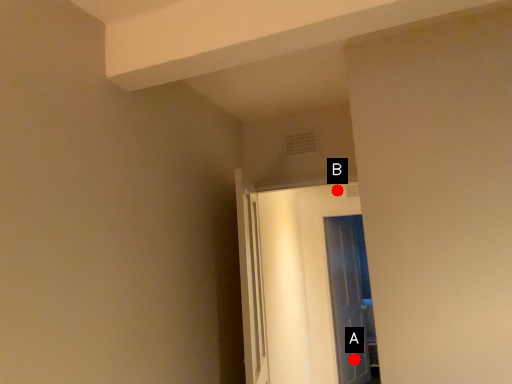
Question: Two points are circled on the image, labeled by A and B beside each circle. Which point is further to the camera?

Choices:
 (A) A is further
 (B) B is further

Answer: (B)